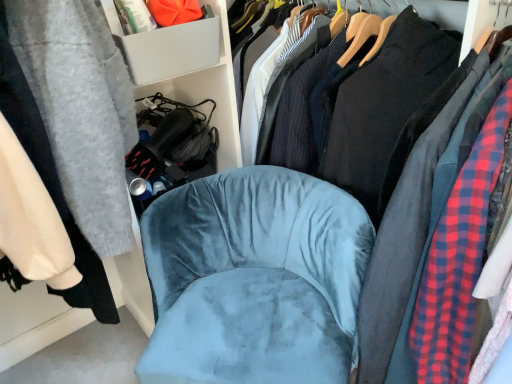
Where is `velvet blue chair at center`? This screenshot has width=512, height=384. velvet blue chair at center is located at coordinates (254, 279).

Where is `gray plastic storage bin at upper left`? gray plastic storage bin at upper left is located at coordinates (166, 48).

Locate an element on the screen. This screenshot has height=384, width=512. velvet blue chair at center is located at coordinates (254, 279).

Are velvet blue chair at center and black cotton shirt at center making contact?

There is a gap between velvet blue chair at center and black cotton shirt at center.

Locate an element on the screen. clothing above the velvet blue chair at center (from the image's perspective) is located at coordinates (413, 234).

Measure the distance from velvet blue chair at center to black cotton shirt at center.

velvet blue chair at center is 10.16 inches away from black cotton shirt at center.

From a real-world perspective, is velvet blue chair at center positioned under black cotton shirt at center based on gravity?

Yes, from a real-world perspective, velvet blue chair at center is below black cotton shirt at center.

Can you tell me how much velvet blue chair at center and gray plastic storage bin at upper left differ in facing direction?

velvet blue chair at center and gray plastic storage bin at upper left are facing 47.7 degrees away from each other.

Find the location of a particular element. chair in front of the gray plastic storage bin at upper left is located at coordinates (254, 279).

From the image's perspective, relative to gray plastic storage bin at upper left, is velvet blue chair at center above or below?

velvet blue chair at center is below gray plastic storage bin at upper left.

Is point (234, 281) closer or farther from the camera than point (143, 64)?

Point (234, 281) is farther from the camera than point (143, 64).

Who is more distant, black cotton shirt at center or gray plastic storage bin at upper left?

gray plastic storage bin at upper left is further away from the camera.

Consider the image. Is black cotton shirt at center located outside gray plastic storage bin at upper left?

Yes.

Which is more to the left, black cotton shirt at center or gray plastic storage bin at upper left?

gray plastic storage bin at upper left is more to the left.

Considering the points (489, 107) and (207, 41), which point is in front, point (489, 107) or point (207, 41)?

The point (489, 107) is more forward.

Who is taller, black cotton shirt at center or velvet blue chair at center?

black cotton shirt at center.

Between black cotton shirt at center and velvet blue chair at center, which one has larger width?

With larger width is black cotton shirt at center.

From a real-world perspective, is black cotton shirt at center physically located above or below velvet blue chair at center?

black cotton shirt at center is situated higher than velvet blue chair at center in the real world.

Is the depth of black cotton shirt at center greater than that of velvet blue chair at center?

No, black cotton shirt at center is closer to the viewer.

Considering the positions of point (218, 7) and point (419, 154), is point (218, 7) closer or farther from the camera than point (419, 154)?

Clearly, point (218, 7) is more distant from the camera than point (419, 154).

This screenshot has width=512, height=384. Find the location of `clothing located on the right of gray plastic storage bin at upper left`. clothing located on the right of gray plastic storage bin at upper left is located at coordinates (413, 234).

Which is more to the left, gray plastic storage bin at upper left or velvet blue chair at center?

gray plastic storage bin at upper left.

Which object is more forward, gray plastic storage bin at upper left or velvet blue chair at center?

velvet blue chair at center is closer to the camera.

Does gray plastic storage bin at upper left turn towards velvet blue chair at center?

No, gray plastic storage bin at upper left is not turned towards velvet blue chair at center.

Is gray plastic storage bin at upper left in contact with velvet blue chair at center?

No, gray plastic storage bin at upper left is not making contact with velvet blue chair at center.

I want to click on clothing above the velvet blue chair at center (from a real-world perspective), so click(413, 234).

The height and width of the screenshot is (384, 512). What are the coordinates of `cabinet located on the left of velvet blue chair at center` in the screenshot? It's located at (166, 48).

Estimate the real-world distances between objects in this image. Which object is further from velvet blue chair at center, gray plastic storage bin at upper left or black cotton shirt at center?

gray plastic storage bin at upper left.

Based on their spatial positions, is velvet blue chair at center or gray plastic storage bin at upper left further from black cotton shirt at center?

gray plastic storage bin at upper left is positioned further to the anchor black cotton shirt at center.

Looking at this image, from the image, which object appears to be farther from gray plastic storage bin at upper left, black cotton shirt at center or velvet blue chair at center?

black cotton shirt at center is further to gray plastic storage bin at upper left.

Considering their positions, is black cotton shirt at center positioned further to velvet blue chair at center than gray plastic storage bin at upper left?

The object further to velvet blue chair at center is gray plastic storage bin at upper left.

Estimate the real-world distances between objects in this image. Which object is closer to gray plastic storage bin at upper left, velvet blue chair at center or black cotton shirt at center?

velvet blue chair at center is closer to gray plastic storage bin at upper left.

From the image, which object appears to be farther from black cotton shirt at center, gray plastic storage bin at upper left or velvet blue chair at center?

gray plastic storage bin at upper left lies further to black cotton shirt at center than the other object.

Locate an element on the screen. Image resolution: width=512 pixels, height=384 pixels. clothing between gray plastic storage bin at upper left and velvet blue chair at center from top to bottom is located at coordinates (413, 234).